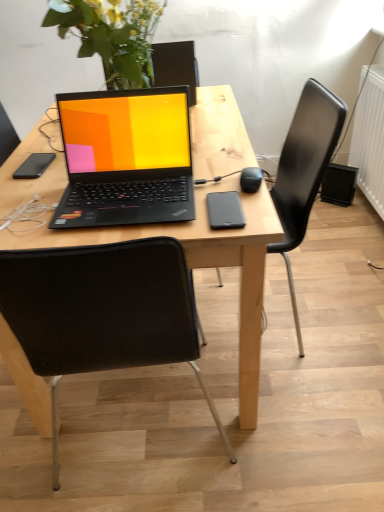
What is the approximate width of black matte laptop at center?

The width of black matte laptop at center is 12.04 inches.

Where is `black fabric chair at center, placed as the second chair when sorted from right to left`? Image resolution: width=384 pixels, height=512 pixels. black fabric chair at center, placed as the second chair when sorted from right to left is located at coordinates (102, 312).

What do you see at coordinates (225, 210) in the screenshot? I see `black matte phone at center, the first mobile phone from the right` at bounding box center [225, 210].

How much space does black matte phone at center, which appears as the 2th mobile phone when viewed from the back, occupy vertically?

1.65 centimeters.

Find the location of a particular element. The height and width of the screenshot is (512, 384). black matte computer mouse at center-right is located at coordinates (251, 179).

You are a GUI agent. You are given a task and a screenshot of the screen. Output one action in this format:
    pyautogui.click(x=<x>, y=<y>)
    Task: Click on the black matte laptop at center
    Image resolution: width=384 pixels, height=512 pixels.
    Given the screenshot: What is the action you would take?
    pyautogui.click(x=126, y=158)

Considering the relative positions of black matte computer mouse at center-right and white plastic radiator at right in the image provided, is black matte computer mouse at center-right behind white plastic radiator at right?

No.

In the scene shown: Is the surface of black matte computer mouse at center-right in direct contact with white plastic radiator at right?

black matte computer mouse at center-right and white plastic radiator at right are not in contact.

Between black matte computer mouse at center-right and white plastic radiator at right, which one appears on the left side from the viewer's perspective?

black matte computer mouse at center-right is more to the left.

From the picture: Is black matte computer mouse at center-right facing towards white plastic radiator at right?

No, black matte computer mouse at center-right is not oriented towards white plastic radiator at right.

From the image's perspective, between black fabric chair at center, marked as the 1th chair in a left-to-right arrangement, and black matte laptop at center, who is located below?

From the image's view, black fabric chair at center, marked as the 1th chair in a left-to-right arrangement, is below.

Can you confirm if black fabric chair at center, placed as the second chair when sorted from right to left, is taller than black matte laptop at center?

Yes, black fabric chair at center, placed as the second chair when sorted from right to left, is taller than black matte laptop at center.

Looking at this image, is black fabric chair at center, placed as the second chair when sorted from right to left, next to black matte laptop at center and touching it?

They are not placed beside each other.

Is black plastic chair at center, positioned as the first chair in right-to-left order, taller than black fabric chair at center, marked as the 1th chair in a left-to-right arrangement?

Indeed, black plastic chair at center, positioned as the first chair in right-to-left order, has a greater height compared to black fabric chair at center, marked as the 1th chair in a left-to-right arrangement.

Between black plastic chair at center, the 2th chair when ordered from left to right, and black fabric chair at center, placed as the second chair when sorted from right to left, which one appears on the right side from the viewer's perspective?

black plastic chair at center, the 2th chair when ordered from left to right, is more to the right.

From the image's perspective, which one is positioned higher, black plastic chair at center, the 2th chair when ordered from left to right, or black fabric chair at center, marked as the 1th chair in a left-to-right arrangement?

black plastic chair at center, the 2th chair when ordered from left to right, appears higher in the image.

Considering their positions, is black plastic chair at center, the 2th chair when ordered from left to right, located in front of or behind black fabric chair at center, marked as the 1th chair in a left-to-right arrangement?

black plastic chair at center, the 2th chair when ordered from left to right, is behind black fabric chair at center, marked as the 1th chair in a left-to-right arrangement.

Which of these two, black matte laptop at center or white plastic radiator at right, stands shorter?

black matte laptop at center is shorter.

Is black matte laptop at center thinner than white plastic radiator at right?

No.

Does black matte laptop at center lie in front of white plastic radiator at right?

Yes, black matte laptop at center is in front of white plastic radiator at right.

Is black matte laptop at center not within white plastic radiator at right?

Absolutely, black matte laptop at center is external to white plastic radiator at right.

Is black plastic chair at center, the 2th chair when ordered from left to right, located outside black matte computer mouse at center-right?

black plastic chair at center, the 2th chair when ordered from left to right, lies outside black matte computer mouse at center-right's area.

In the scene shown: In terms of width, does black plastic chair at center, the 2th chair when ordered from left to right, look wider or thinner when compared to black matte computer mouse at center-right?

In the image, black plastic chair at center, the 2th chair when ordered from left to right, appears to be wider than black matte computer mouse at center-right.

Based on the photo, from the image's perspective, is black plastic chair at center, positioned as the first chair in right-to-left order, under black matte computer mouse at center-right?

Yes, from the image's perspective, black plastic chair at center, positioned as the first chair in right-to-left order, is below black matte computer mouse at center-right.

Considering the positions of objects black plastic chair at center, positioned as the first chair in right-to-left order, and black matte computer mouse at center-right in the image provided, who is behind, black plastic chair at center, positioned as the first chair in right-to-left order, or black matte computer mouse at center-right?

black plastic chair at center, positioned as the first chair in right-to-left order, is behind.

Could you measure the distance between black matte phone at left, positioned as the first mobile phone in top-to-bottom order, and black matte phone at center, marked as the 2th mobile phone in a top-to-bottom arrangement?

4.61 feet.

Could you tell me if black matte phone at left, positioned as the first mobile phone in top-to-bottom order, is facing black matte phone at center, the 2th mobile phone in the left-to-right sequence?

No, black matte phone at left, positioned as the first mobile phone in top-to-bottom order, is not aimed at black matte phone at center, the 2th mobile phone in the left-to-right sequence.

Which object is further away from the camera, black matte phone at left, acting as the second mobile phone starting from the front, or black matte phone at center, marked as the 1th mobile phone in a bottom-to-top arrangement?

black matte phone at left, acting as the second mobile phone starting from the front.

Is black matte phone at left, acting as the second mobile phone starting from the front, bigger or smaller than black matte phone at center, the first mobile phone from the right?

Clearly, black matte phone at left, acting as the second mobile phone starting from the front, is smaller in size than black matte phone at center, the first mobile phone from the right.

Is white plastic radiator at right positioned far away from wooden desk at center?

That's right, there is a large distance between white plastic radiator at right and wooden desk at center.

From a real-world perspective, is white plastic radiator at right physically below wooden desk at center?

Yes, from a real-world perspective, white plastic radiator at right is below wooden desk at center.

Find the location of a particular element. Image resolution: width=384 pixels, height=512 pixels. desk on the left of the white plastic radiator at right is located at coordinates (199, 264).

Can you tell me how much white plastic radiator at right and wooden desk at center differ in facing direction?

white plastic radiator at right and wooden desk at center are facing 1.62 degrees away from each other.

Locate an element on the screen. The width and height of the screenshot is (384, 512). computer mouse that is below the white plastic radiator at right (from the image's perspective) is located at coordinates (251, 179).

The image size is (384, 512). Identify the location of chair to the left of black matte laptop at center. (102, 312).

When comparing their distances from black matte phone at center, which appears as the 2th mobile phone when viewed from the back, does black plastic chair at center, the 2th chair when ordered from left to right, or wooden desk at center seem closer?

wooden desk at center lies closer to black matte phone at center, which appears as the 2th mobile phone when viewed from the back, than the other object.

Looking at the image, which one is located closer to black matte phone at left, acting as the second mobile phone starting from the front, white plastic radiator at right or black plastic chair at center, positioned as the first chair in right-to-left order?

black plastic chair at center, positioned as the first chair in right-to-left order, is positioned closer to the anchor black matte phone at left, acting as the second mobile phone starting from the front.

Based on their spatial positions, is white plastic radiator at right or black matte phone at center, marked as the 2th mobile phone in a top-to-bottom arrangement, further from black matte laptop at center?

white plastic radiator at right is positioned further to the anchor black matte laptop at center.

Which object lies further to the anchor point black matte computer mouse at center-right, black matte laptop at center or black matte phone at left, positioned as the first mobile phone in top-to-bottom order?

Based on the image, black matte phone at left, positioned as the first mobile phone in top-to-bottom order, appears to be further to black matte computer mouse at center-right.

Which object lies further to the anchor point black matte computer mouse at center-right, wooden desk at center or black matte phone at left, which appears as the second mobile phone when ordered from the bottom?

black matte phone at left, which appears as the second mobile phone when ordered from the bottom, is further to black matte computer mouse at center-right.

Considering their positions, is wooden desk at center positioned closer to black matte phone at center, marked as the 2th mobile phone in a top-to-bottom arrangement, than black plastic chair at center, the 2th chair when ordered from left to right?

wooden desk at center is positioned closer to the anchor black matte phone at center, marked as the 2th mobile phone in a top-to-bottom arrangement.

Which object lies further to the anchor point black fabric chair at center, placed as the second chair when sorted from right to left, wooden desk at center or black plastic chair at center, positioned as the first chair in right-to-left order?

Based on the image, black plastic chair at center, positioned as the first chair in right-to-left order, appears to be further to black fabric chair at center, placed as the second chair when sorted from right to left.

Looking at the image, which one is located further to black matte phone at center, which appears as the 1th mobile phone when viewed from the front, black plastic chair at center, the 2th chair when ordered from left to right, or black matte laptop at center?

Based on the image, black plastic chair at center, the 2th chair when ordered from left to right, appears to be further to black matte phone at center, which appears as the 1th mobile phone when viewed from the front.

Identify the location of mobile phone between black matte phone at left, which appears as the second mobile phone when ordered from the bottom, and black plastic chair at center, positioned as the first chair in right-to-left order, from left to right. The width and height of the screenshot is (384, 512). (225, 210).

The width and height of the screenshot is (384, 512). Find the location of `laptop situated between black matte phone at left, positioned as the first mobile phone in top-to-bottom order, and black matte computer mouse at center-right from left to right`. laptop situated between black matte phone at left, positioned as the first mobile phone in top-to-bottom order, and black matte computer mouse at center-right from left to right is located at coordinates (126, 158).

Where is `mobile phone between wooden desk at center and black matte computer mouse at center-right in the horizontal direction`? mobile phone between wooden desk at center and black matte computer mouse at center-right in the horizontal direction is located at coordinates (225, 210).

The width and height of the screenshot is (384, 512). What are the coordinates of `computer mouse that lies between black matte laptop at center and black fabric chair at center, placed as the second chair when sorted from right to left, from top to bottom` in the screenshot? It's located at (251, 179).